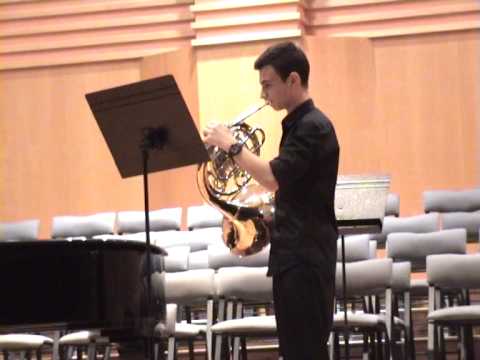
Identify the location of risers. pyautogui.click(x=418, y=327).